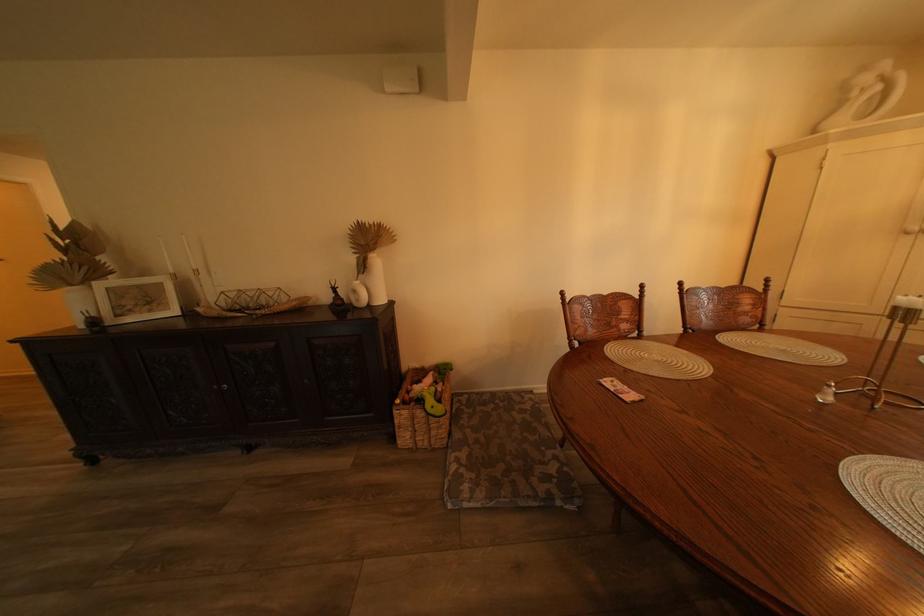
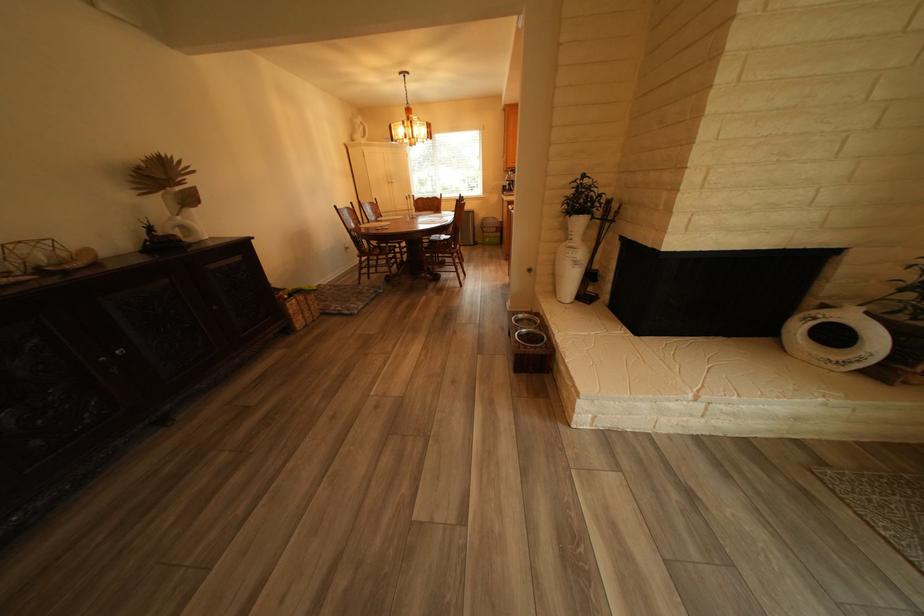
Locate, in the second image, the point that corresponds to (410,423) in the first image.

(305, 312)